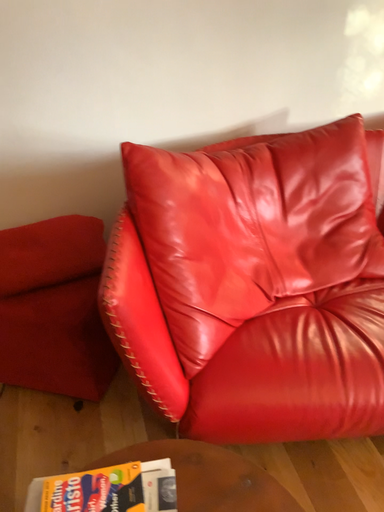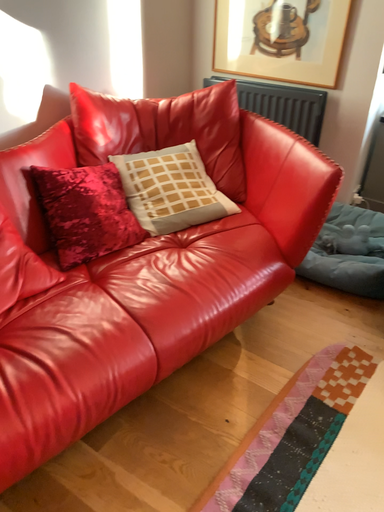
Question: How did the camera likely rotate when shooting the video?

Choices:
 (A) rotated right
 (B) rotated left

Answer: (A)